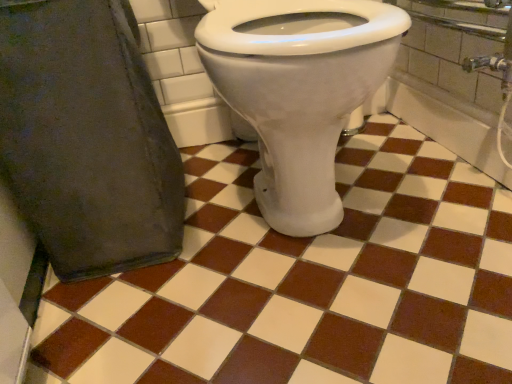
Question: Should I look upward or downward to see brown glossy tile at center?

Choices:
 (A) down
 (B) up

Answer: (A)